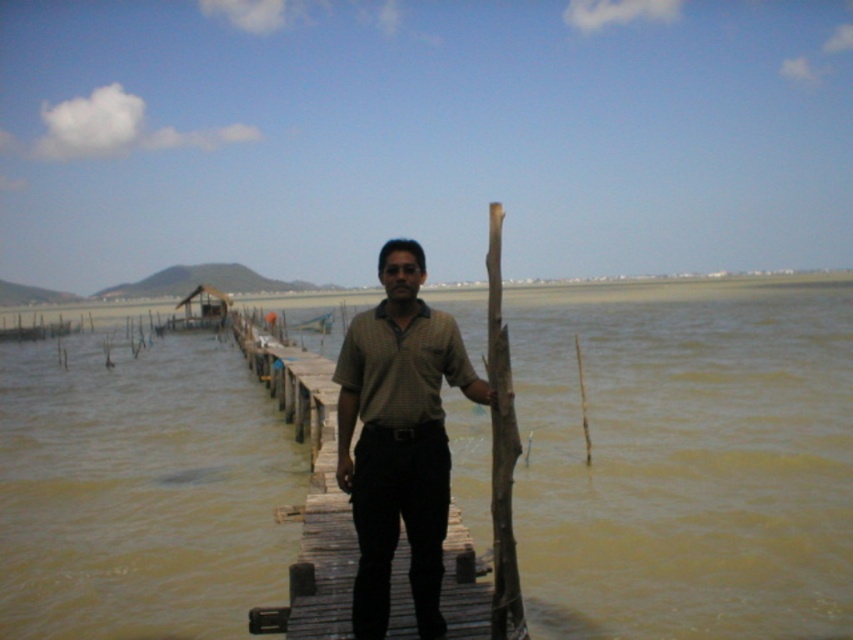
Which is more to the right, brown muddy water at center or brown cotton shirt at center?

From the viewer's perspective, brown muddy water at center appears more on the right side.

Does brown muddy water at center appear under brown cotton shirt at center?

No, brown muddy water at center is not below brown cotton shirt at center.

Describe the element at coordinates (686, 460) in the screenshot. The image size is (853, 640). I see `brown muddy water at center` at that location.

Where is `brown muddy water at center`? The image size is (853, 640). brown muddy water at center is located at coordinates (686, 460).